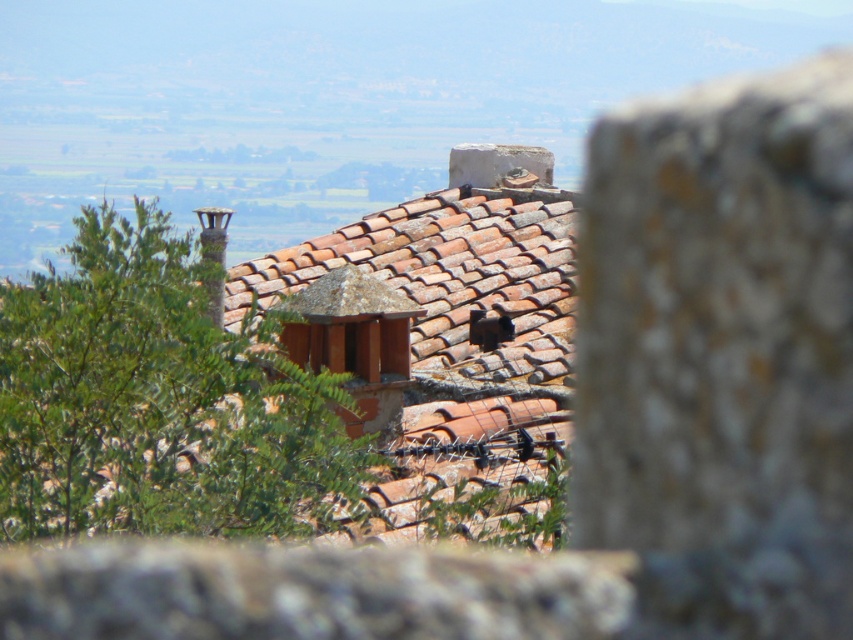
You are standing in front of the tiled roof scene. There are two points marked on the roof. One is at coordinate point (515,272) and the other at point (466,176). Which point is closer to you?

Point (515,272) is closer to the viewer than point (466,176).

You are a gardener planning to trim the green leafy tree at left. Considering its position relative to the terracotta tiles at center, which direction should you avoid cutting branches to prevent them from growing towards the roof?

The green leafy tree at left is positioned under terracotta tiles at center. To prevent branches from growing towards the roof, avoid cutting branches that are growing upward or toward the center of the roof.

You are standing in front of the tiled roof scene and want to determine the relative positions of two points marked on the image. Which point, point (22, 387) or point (502, 481), is closer to you?

Point (22, 387) is closer to the viewer than point (502, 481).